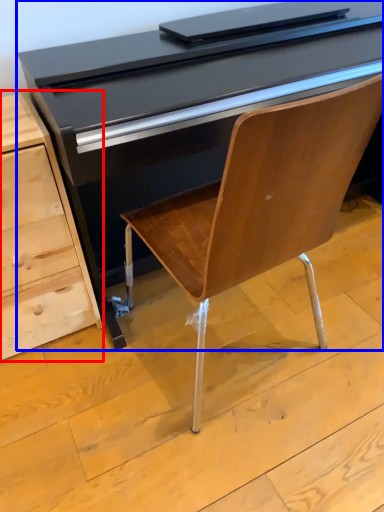
Question: Which object is closer to the camera taking this photo, chest of drawers (highlighted by a red box) or desk (highlighted by a blue box)?

Choices:
 (A) chest of drawers
 (B) desk

Answer: (B)